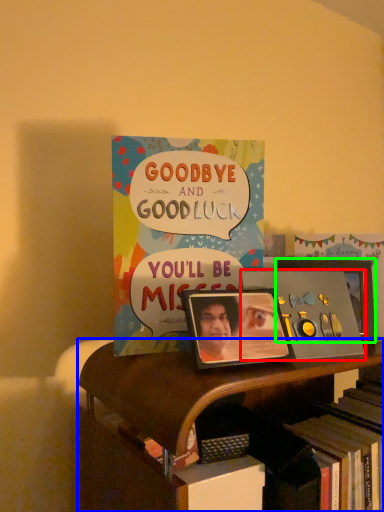
Question: Estimate the real-world distances between objects in this image. Which object is closer to album cover (highlighted by a red box), bookcase (highlighted by a blue box) or picture frame (highlighted by a green box)?

Choices:
 (A) bookcase
 (B) picture frame

Answer: (B)